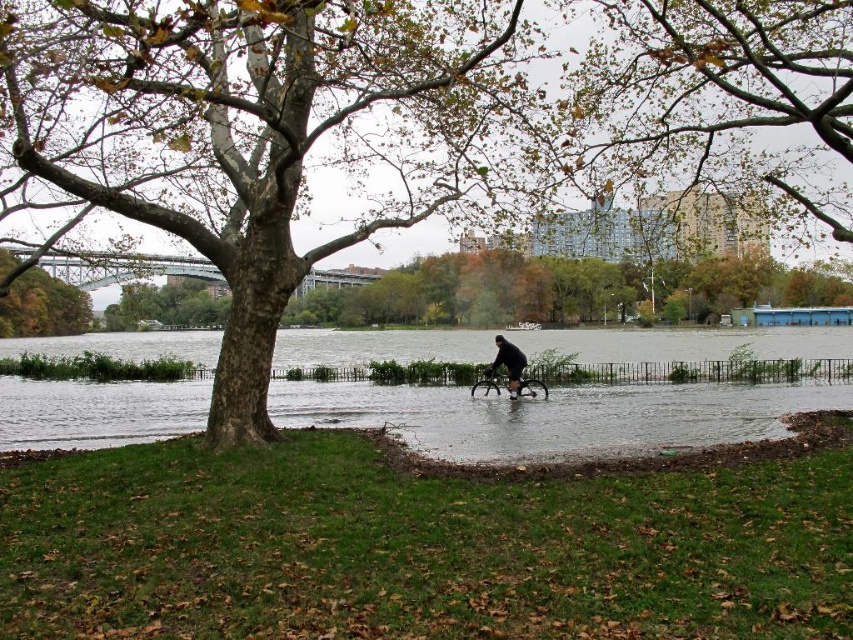
Question: Is clear water at center bigger than brown matte tree at upper left?

Choices:
 (A) no
 (B) yes

Answer: (B)

Question: Is clear water at center to the left of brown matte tree at upper left from the viewer's perspective?

Choices:
 (A) yes
 (B) no

Answer: (B)

Question: Which of the following is the farthest from the observer?

Choices:
 (A) brown matte tree at center
 (B) black matte bicycle at center
 (C) shiny black bicycle at center

Answer: (C)

Question: Which point is closer to the camera taking this photo?

Choices:
 (A) (463, 419)
 (B) (480, 376)
 (C) (515, 353)

Answer: (A)

Question: From the image, what is the correct spatial relationship of brown matte tree at upper left in relation to shiny black bicycle at center?

Choices:
 (A) left
 (B) right

Answer: (A)

Question: Which of the following is the closest to the observer?

Choices:
 (A) dark matte bicycle at center
 (B) black matte bicycle at center
 (C) brown matte tree at center
 (D) shiny black bicycle at center

Answer: (C)